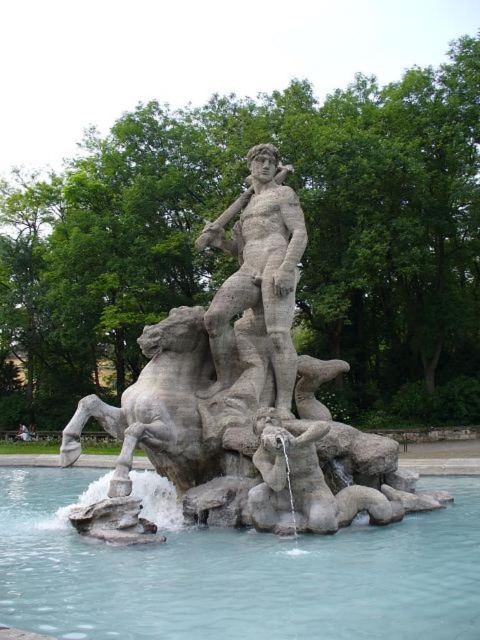
Question: Among these objects, which one is nearest to the camera?

Choices:
 (A) stone statue at center
 (B) gray stone statue at center
 (C) clear blue water at center

Answer: (C)

Question: Is stone statue at center smaller than clear blue water at center?

Choices:
 (A) yes
 (B) no

Answer: (B)

Question: Considering the real-world distances, which object is farthest from the stone statue at center?

Choices:
 (A) gray stone statue at center
 (B) clear blue water at center

Answer: (B)

Question: Observing the image, what is the correct spatial positioning of stone statue at center in reference to gray stone statue at center?

Choices:
 (A) left
 (B) right

Answer: (B)

Question: Which point is farther to the camera?

Choices:
 (A) (279, 460)
 (B) (251, 244)
 (C) (160, 593)

Answer: (B)

Question: Can you confirm if stone statue at center is positioned to the right of clear blue water at center?

Choices:
 (A) yes
 (B) no

Answer: (A)